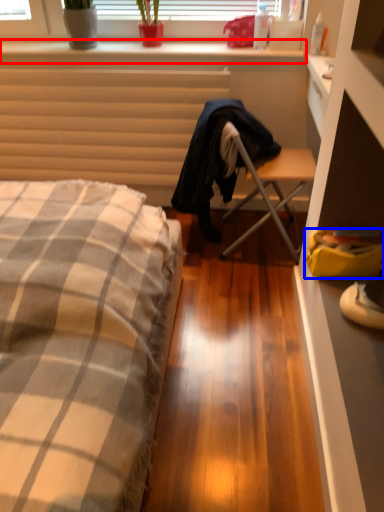
Question: Which of the following is the closest to the observer, window sill (highlighted by a red box) or handbag (highlighted by a blue box)?

Choices:
 (A) window sill
 (B) handbag

Answer: (B)